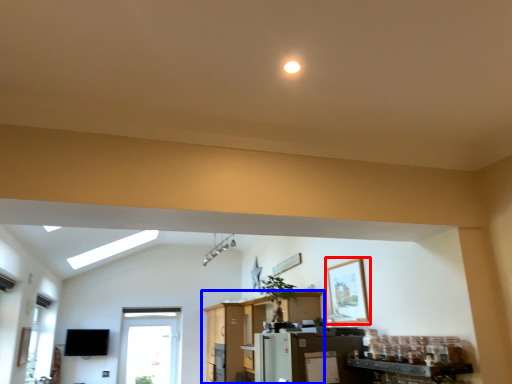
Question: Which object appears farthest to the camera in this image, picture frame (highlighted by a red box) or entertainment center (highlighted by a blue box)?

Choices:
 (A) picture frame
 (B) entertainment center

Answer: (B)